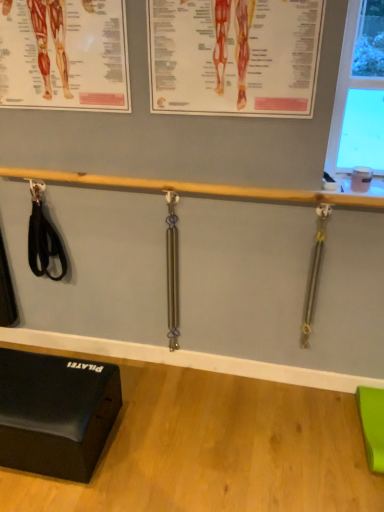
Question: Is gold metallic weight at right, acting as the 2th weight starting from the left, situated inside polished metal weight at center, which appears as the 1th weight when viewed from the left, or outside?

Choices:
 (A) outside
 (B) inside

Answer: (A)

Question: From a real-world perspective, is gold metallic weight at right, acting as the 2th weight starting from the left, physically located above or below polished metal weight at center, the 2th weight in the right-to-left sequence?

Choices:
 (A) below
 (B) above

Answer: (B)

Question: Based on their relative distances, which object is farther from the orange paper poster at upper center, positioned as the first poster page in right-to-left order?

Choices:
 (A) matte paper poster at upper left, the first poster page in the left-to-right sequence
 (B) gold metallic weight at right, acting as the 2th weight starting from the left
 (C) wooden bar at center
 (D) black rubber exercise block at lower left
 (E) polished metal weight at center, the 2th weight in the right-to-left sequence

Answer: (D)

Question: Estimate the real-world distances between objects in this image. Which object is closer to the wooden bar at center?

Choices:
 (A) black rubber exercise block at lower left
 (B) gold metallic weight at right, the first weight when ordered from right to left
 (C) orange paper poster at upper center, which is counted as the 2th poster page, starting from the left
 (D) polished metal weight at center, which appears as the 1th weight when viewed from the left
 (E) matte paper poster at upper left, positioned as the second poster page in right-to-left order

Answer: (D)